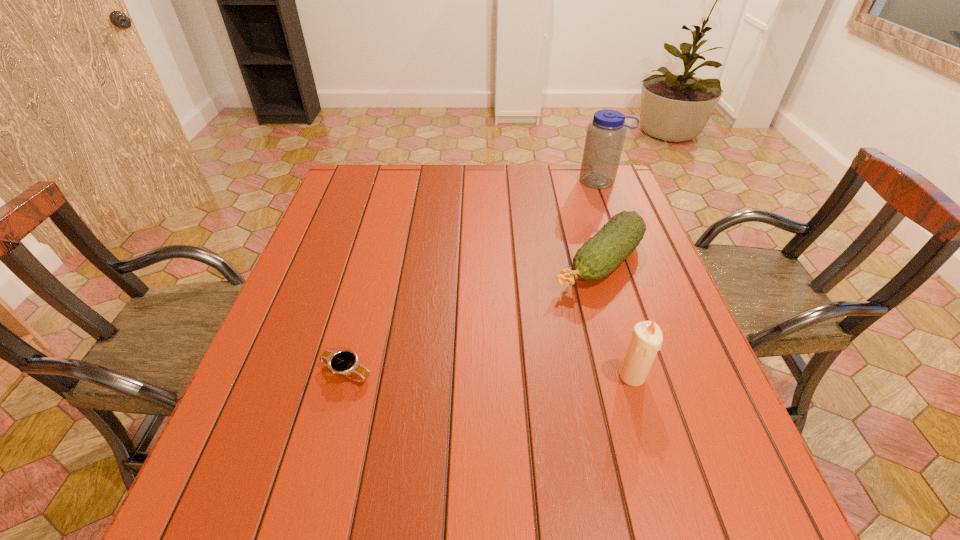
You are a GUI agent. You are given a task and a screenshot of the screen. Output one action in this format:
    pyautogui.click(x=<x>, y=<y>)
    Task: Click on the vacant spot on the desktop that is between the leftmost object and the candle and is positioned with a carrying loop on the side of the farthest object
    
    Given the screenshot: What is the action you would take?
    pyautogui.click(x=467, y=374)

I want to click on free space on the desktop that is between the leftmost object and the second tallest object and is positioned at the blossom end of the second farthest object, so pyautogui.click(x=473, y=374).